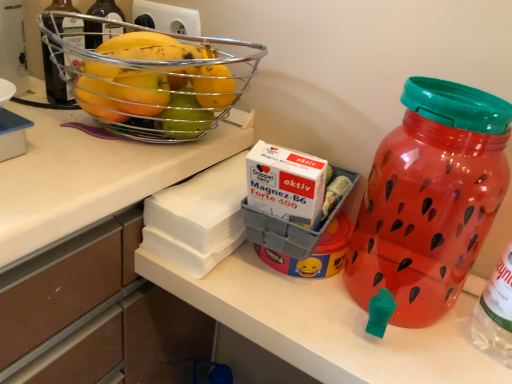
Image resolution: width=512 pixels, height=384 pixels. What do you see at coordinates (430, 199) in the screenshot?
I see `translucent plastic water jug at right` at bounding box center [430, 199].

Measure the distance between translucent plastic water jug at right and camera.

translucent plastic water jug at right and camera are 39.70 centimeters apart from each other.

Find the location of a particular element. translucent plastic water jug at right is located at coordinates (430, 199).

Describe the element at coordinates (155, 95) in the screenshot. I see `metallic wire basket at upper left` at that location.

What are the coordinates of `metallic wire basket at upper left` in the screenshot? It's located at (155, 95).

Find the location of a particular element. Image resolution: width=512 pixels, height=384 pixels. translucent plastic water jug at right is located at coordinates (430, 199).

Is translucent plastic water jug at right at the left side of metallic wire basket at upper left?

No.

Between translucent plastic water jug at right and metallic wire basket at upper left, which one is positioned behind?

metallic wire basket at upper left is further from the camera.

Considering the points (505, 159) and (159, 101), which point is behind, point (505, 159) or point (159, 101)?

The point (505, 159) is more distant.

From the image's perspective, between translucent plastic water jug at right and metallic wire basket at upper left, who is located below?

translucent plastic water jug at right, from the image's perspective.

From a real-world perspective, which is physically below, translucent plastic water jug at right or metallic wire basket at upper left?

From a 3D spatial view, translucent plastic water jug at right is below.

Considering the relative sizes of translucent plastic water jug at right and metallic wire basket at upper left in the image provided, is translucent plastic water jug at right thinner than metallic wire basket at upper left?

Indeed, translucent plastic water jug at right has a lesser width compared to metallic wire basket at upper left.

Which of these two, translucent plastic water jug at right or metallic wire basket at upper left, stands taller?

translucent plastic water jug at right.

Does translucent plastic water jug at right have a smaller size compared to metallic wire basket at upper left?

Yes, translucent plastic water jug at right is smaller than metallic wire basket at upper left.

Is translucent plastic water jug at right positioned beyond the bounds of metallic wire basket at upper left?

Yes, translucent plastic water jug at right is outside of metallic wire basket at upper left.

Is translucent plastic water jug at right beside metallic wire basket at upper left?

No, translucent plastic water jug at right is not beside metallic wire basket at upper left.

Is translucent plastic water jug at right turned away from metallic wire basket at upper left?

translucent plastic water jug at right is not turned away from metallic wire basket at upper left.

How different are the orientations of translucent plastic water jug at right and metallic wire basket at upper left in degrees?

The facing directions of translucent plastic water jug at right and metallic wire basket at upper left are 90 degrees apart.

Locate an element on the screen. The height and width of the screenshot is (384, 512). bottle below the metallic wire basket at upper left (from the image's perspective) is located at coordinates (430, 199).

Can you confirm if metallic wire basket at upper left is positioned to the right of translucent plastic water jug at right?

No.

Is metallic wire basket at upper left in front of or behind translucent plastic water jug at right in the image?

In the image, metallic wire basket at upper left appears behind translucent plastic water jug at right.

Which is farther, (196, 70) or (443, 99)?

Point (196, 70)

From the image's perspective, is metallic wire basket at upper left on translucent plastic water jug at right?

Yes, from the image's perspective, metallic wire basket at upper left is over translucent plastic water jug at right.

Based on the photo, from a real-world perspective, who is located higher, metallic wire basket at upper left or translucent plastic water jug at right?

From a 3D spatial view, metallic wire basket at upper left is above.

Which of these two, metallic wire basket at upper left or translucent plastic water jug at right, is thinner?

translucent plastic water jug at right.

From the picture: Is metallic wire basket at upper left taller or shorter than translucent plastic water jug at right?

In the image, metallic wire basket at upper left appears to be shorter than translucent plastic water jug at right.

Consider the image. Considering the relative sizes of metallic wire basket at upper left and translucent plastic water jug at right in the image provided, is metallic wire basket at upper left smaller than translucent plastic water jug at right?

No, metallic wire basket at upper left is not smaller than translucent plastic water jug at right.

In the scene shown: Is metallic wire basket at upper left completely or partially outside of translucent plastic water jug at right?

Yes.

Would you consider metallic wire basket at upper left to be distant from translucent plastic water jug at right?

metallic wire basket at upper left is near translucent plastic water jug at right, not far away.

From the picture: Is metallic wire basket at upper left looking in the opposite direction of translucent plastic water jug at right?

That's not correct — metallic wire basket at upper left is not looking away from translucent plastic water jug at right.

How many degrees apart are the facing directions of metallic wire basket at upper left and translucent plastic water jug at right?

The angular difference between metallic wire basket at upper left and translucent plastic water jug at right is 90 degrees.

The height and width of the screenshot is (384, 512). I want to click on grapefruit behind the translucent plastic water jug at right, so click(x=155, y=95).

What are the coordinates of `grapefruit on the left of translucent plastic water jug at right` in the screenshot? It's located at (155, 95).

Where is `bottle that is in front of the metallic wire basket at upper left`? The height and width of the screenshot is (384, 512). bottle that is in front of the metallic wire basket at upper left is located at coordinates (430, 199).